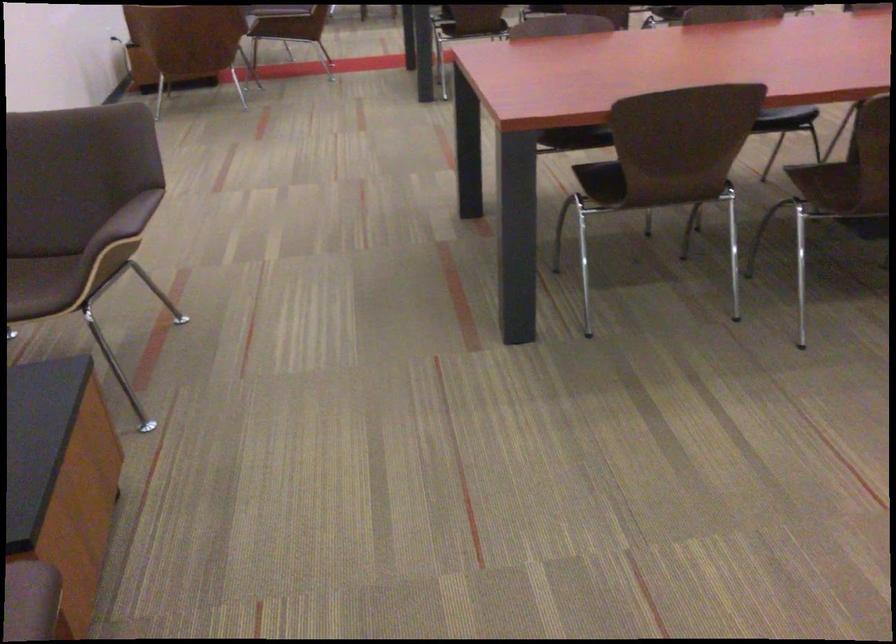
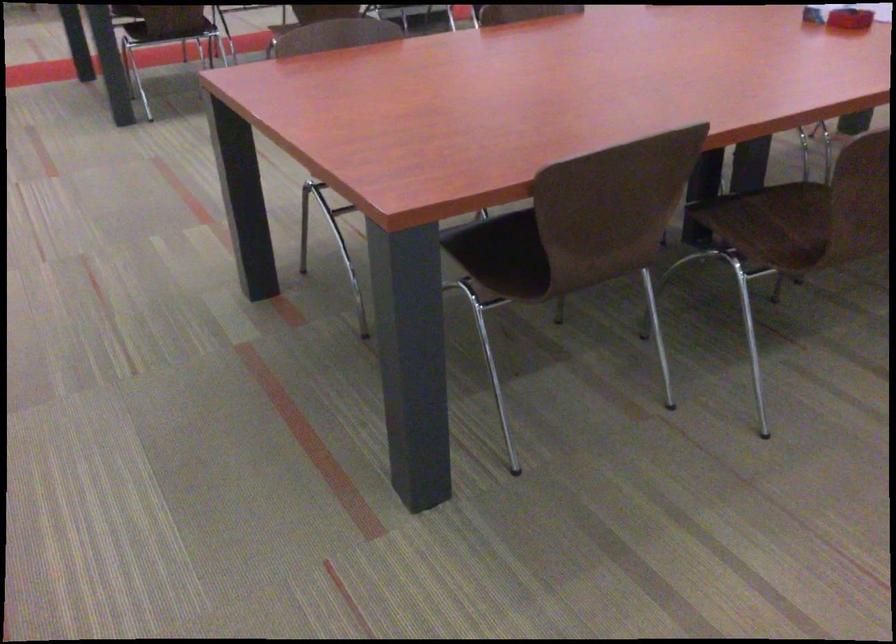
Question: The camera is either moving clockwise (left) or counter-clockwise (right) around the object. The first image is from the beginning of the video and the second image is from the end. Is the camera moving left or right when shooting the video?

Choices:
 (A) Left
 (B) Right

Answer: (A)